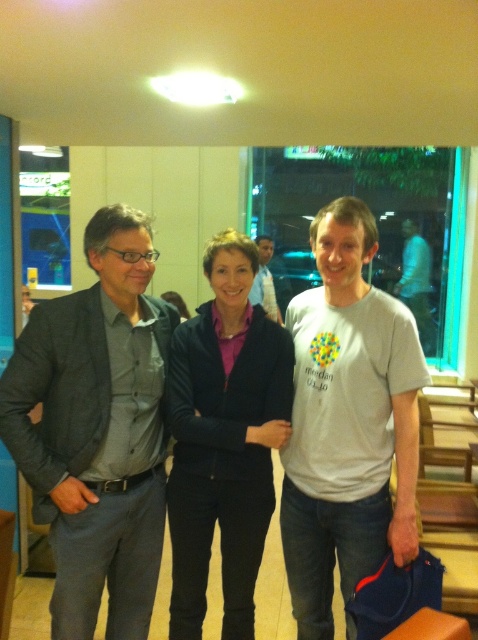
Question: Is dark gray textured blazer at left bigger than matte black jacket at center?

Choices:
 (A) yes
 (B) no

Answer: (A)

Question: Which of the following is the closest to the observer?

Choices:
 (A) (347, 208)
 (B) (261, 296)
 (C) (119, 588)

Answer: (A)

Question: Based on their relative distances, which object is nearer to the light blue shirt at center?

Choices:
 (A) gray cotton t-shirt at center
 (B) matte black jacket at center
 (C) dark gray textured blazer at left

Answer: (B)

Question: Can you confirm if gray cotton t-shirt at center is wider than matte black jacket at center?

Choices:
 (A) no
 (B) yes

Answer: (B)

Question: Which point is farther from the camera taking this photo?

Choices:
 (A) (280, 413)
 (B) (269, 272)
 (C) (334, 273)
 (D) (109, 552)

Answer: (B)

Question: Does matte black jacket at center come behind light blue shirt at center?

Choices:
 (A) yes
 (B) no

Answer: (B)